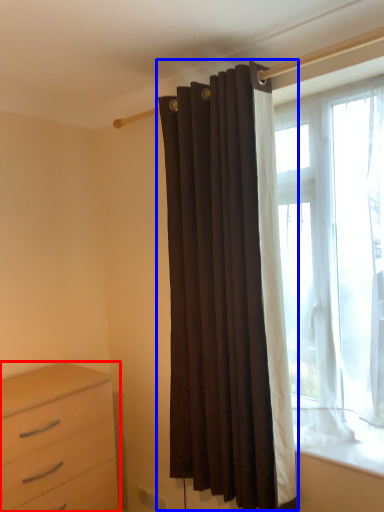
Question: Which object is further to the camera taking this photo, chest of drawers (highlighted by a red box) or curtain (highlighted by a blue box)?

Choices:
 (A) chest of drawers
 (B) curtain

Answer: (A)